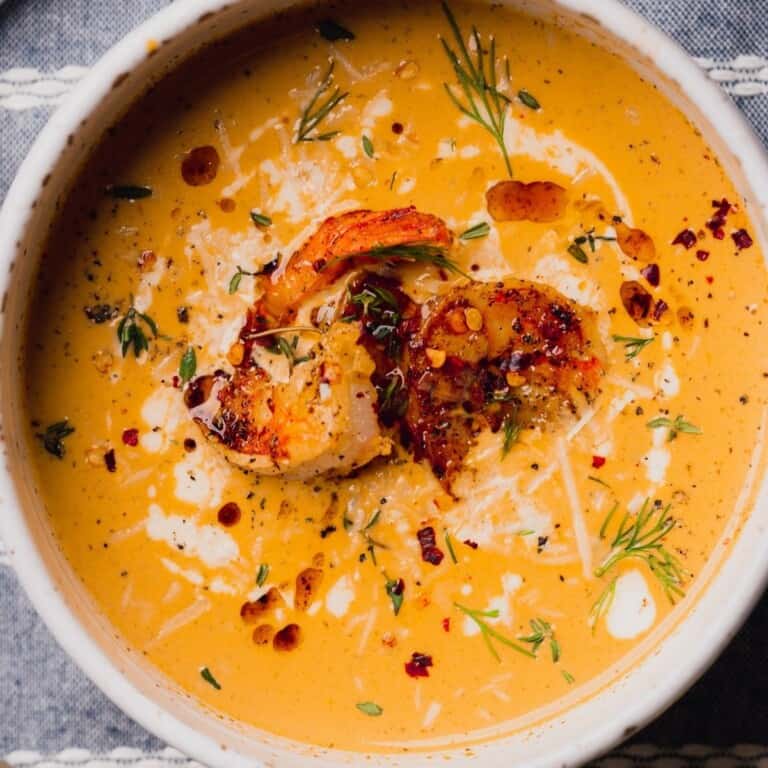
Locate an element on the screen. The image size is (768, 768). green plant is located at coordinates (477, 81), (313, 110), (134, 326), (637, 548), (491, 631).